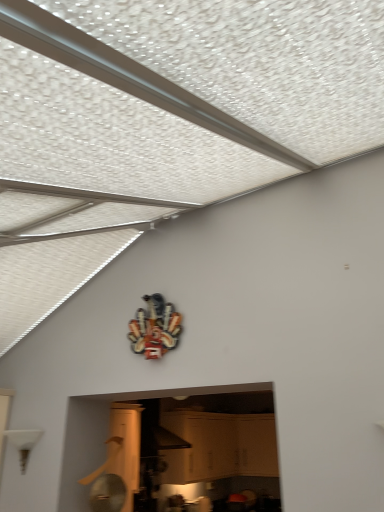
Question: Does white matte cabinet at center have a greater width compared to metallic multi-tool at upper center?

Choices:
 (A) yes
 (B) no

Answer: (A)

Question: Can you confirm if white matte cabinet at center is bigger than metallic multi-tool at upper center?

Choices:
 (A) no
 (B) yes

Answer: (B)

Question: Does white matte cabinet at center turn towards metallic multi-tool at upper center?

Choices:
 (A) no
 (B) yes

Answer: (A)

Question: Is the depth of white matte cabinet at center greater than that of metallic multi-tool at upper center?

Choices:
 (A) no
 (B) yes

Answer: (B)

Question: Considering the relative positions of white matte cabinet at center and metallic multi-tool at upper center in the image provided, is white matte cabinet at center to the left of metallic multi-tool at upper center from the viewer's perspective?

Choices:
 (A) no
 (B) yes

Answer: (A)

Question: Can you confirm if white matte cabinet at center is thinner than metallic multi-tool at upper center?

Choices:
 (A) no
 (B) yes

Answer: (A)

Question: From a real-world perspective, is metallic multi-tool at upper center physically below white matte cabinet at center?

Choices:
 (A) yes
 (B) no

Answer: (B)

Question: Considering the relative sizes of metallic multi-tool at upper center and white matte cabinet at center in the image provided, is metallic multi-tool at upper center smaller than white matte cabinet at center?

Choices:
 (A) yes
 (B) no

Answer: (A)

Question: Is metallic multi-tool at upper center turned away from white matte cabinet at center?

Choices:
 (A) yes
 (B) no

Answer: (B)

Question: Considering the relative positions of metallic multi-tool at upper center and white matte cabinet at center in the image provided, is metallic multi-tool at upper center to the right of white matte cabinet at center from the viewer's perspective?

Choices:
 (A) no
 (B) yes

Answer: (A)

Question: Can you confirm if metallic multi-tool at upper center is wider than white matte cabinet at center?

Choices:
 (A) no
 (B) yes

Answer: (A)

Question: Is metallic multi-tool at upper center to the left of white matte cabinet at center from the viewer's perspective?

Choices:
 (A) yes
 (B) no

Answer: (A)

Question: From their relative heights in the image, would you say metallic multi-tool at upper center is taller or shorter than white matte cabinet at center?

Choices:
 (A) short
 (B) tall

Answer: (A)